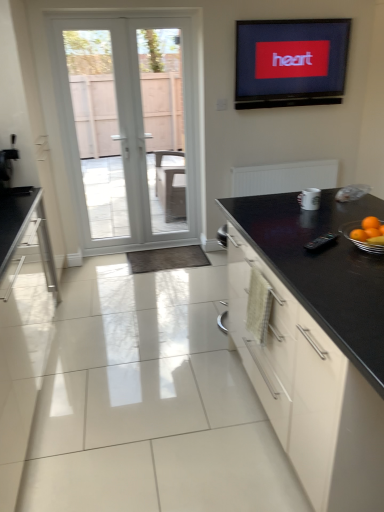
You are a GUI agent. You are given a task and a screenshot of the screen. Output one action in this format:
    pyautogui.click(x=<x>, y=<y>)
    Task: Click on the unoccupied area behind black plastic remote control at center, the first appliance positioned from the front
    This screenshot has width=384, height=512.
    Given the screenshot: What is the action you would take?
    pyautogui.click(x=315, y=229)